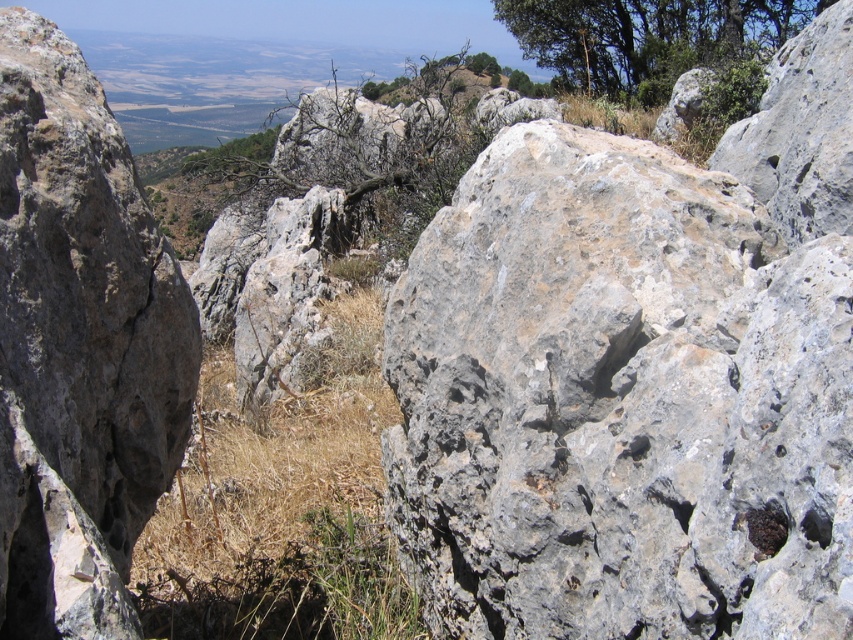
Question: Is dry grass at center to the right of green leafy tree at upper right from the viewer's perspective?

Choices:
 (A) yes
 (B) no

Answer: (B)

Question: Does dry grass at center have a larger size compared to green leafy tree at upper right?

Choices:
 (A) no
 (B) yes

Answer: (A)

Question: Which of the following is the closest to the observer?

Choices:
 (A) (367, 602)
 (B) (613, 70)

Answer: (A)

Question: Which point is closer to the camera?

Choices:
 (A) (610, 90)
 (B) (320, 637)

Answer: (B)

Question: Is dry grass at center positioned at the back of green leafy tree at upper right?

Choices:
 (A) yes
 (B) no

Answer: (B)